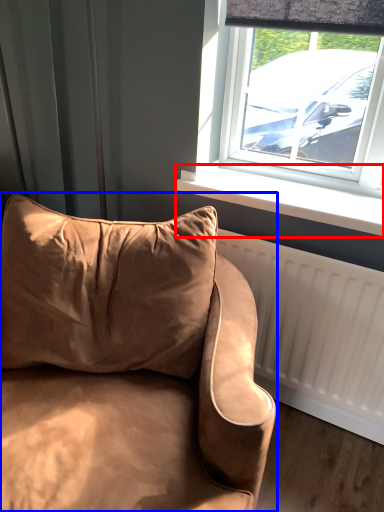
Question: Which object appears closest to the camera in this image, window sill (highlighted by a red box) or studio couch (highlighted by a blue box)?

Choices:
 (A) window sill
 (B) studio couch

Answer: (B)